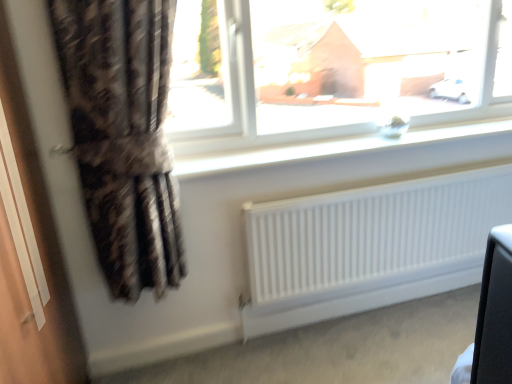
Locate an element on the screen. vacant area that is in front of white matte radiator at lower center is located at coordinates coord(399,344).